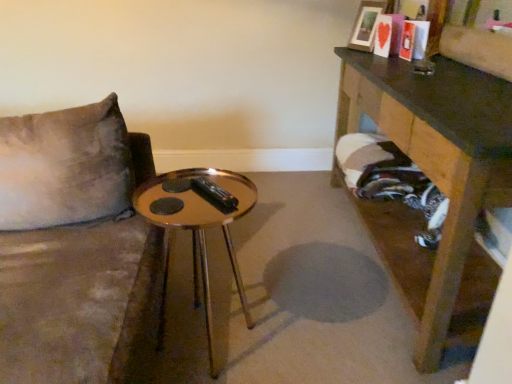
Where is `vacant point above gold reflective table at center, which appears as the 2th table when viewed from the right (from a real-world perspective)`? Image resolution: width=512 pixels, height=384 pixels. vacant point above gold reflective table at center, which appears as the 2th table when viewed from the right (from a real-world perspective) is located at coordinates (x=199, y=195).